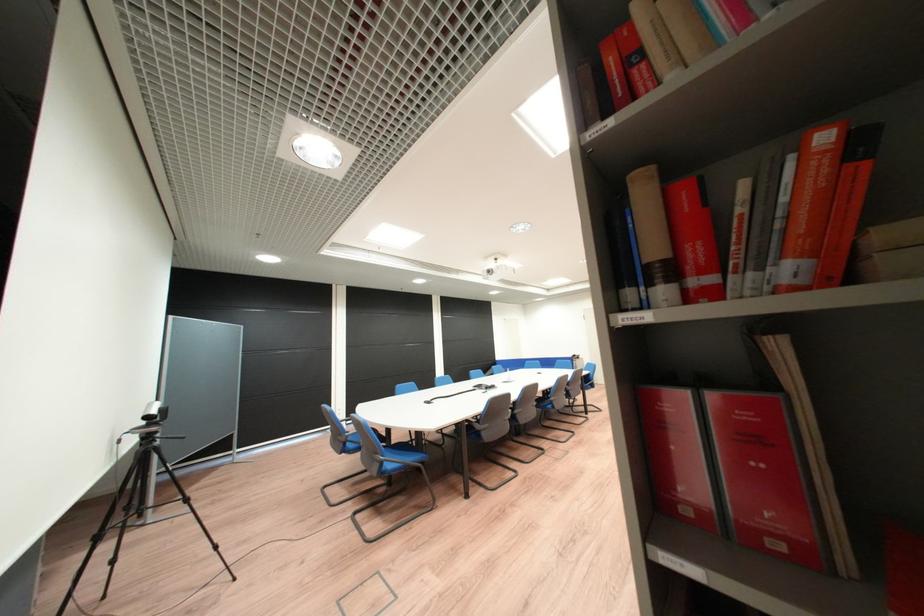
Where would you lift the small grey camera? Please return your answer as a coordinate pair (x, y).

(154, 411)